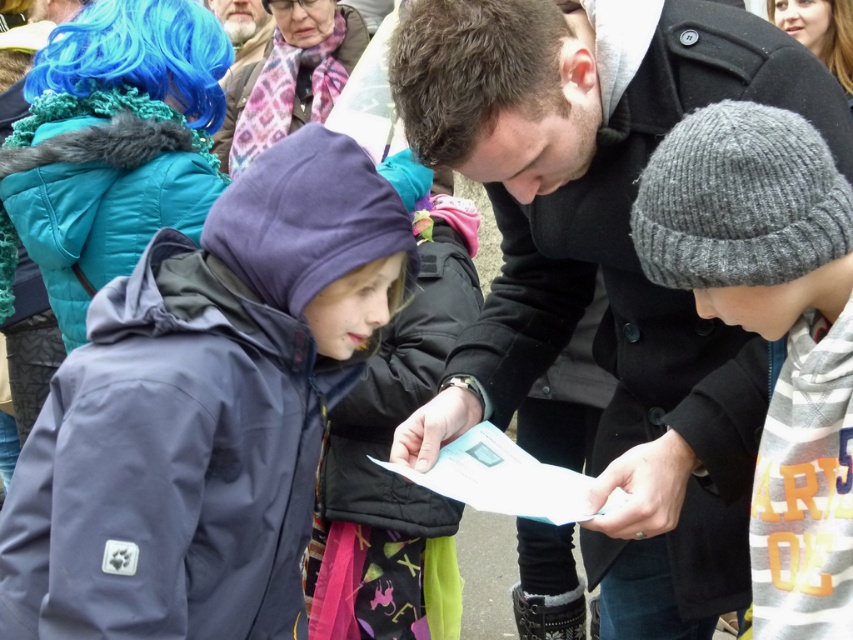
You are a photographer trying to capture a clear shot of the black wool coat at center and the blue synthetic wig at upper right. Since you can only focus on one subject at a time, which one should you choose to ensure the other is still in the background?

You should focus on the black wool coat at center because it is in front of the blue synthetic wig at upper right, so if you focus on the front object, the background object will still be visible but slightly out of focus.

You are a photographer trying to capture a group photo of the black wool coat at center and the matte black coat at upper center. The camera you have can only focus on subjects within a 10 feet range. Will both subjects be in focus if you stand exactly between them?

The black wool coat at center and matte black coat at upper center are 13.56 feet apart from each other. Since the camera can only focus within 10 feet, standing exactly between them would mean each subject is about 6.78 feet away from the camera. This distance is within the 10 feet range, so both subjects will be in focus.

Which object is wider, the gray knitted beanie at center or the blue synthetic wig at upper right?

The gray knitted beeanie at center is wider than the blue synthetic wig at upper right according to the description.